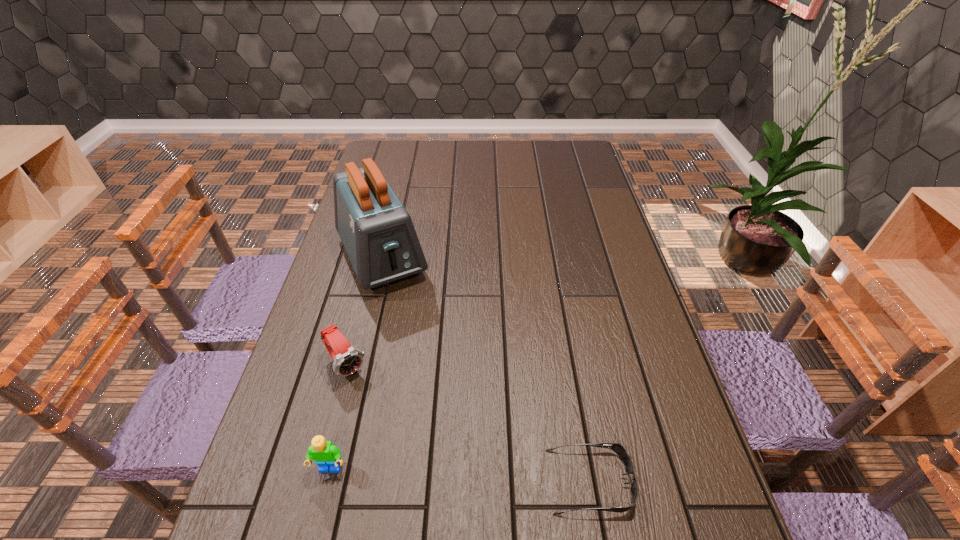
Where is `vacant space that satisfies the following two spatial constraints: 1. on the front side of the rightmost object; 2. on the front-facing side of the toaster`? The width and height of the screenshot is (960, 540). vacant space that satisfies the following two spatial constraints: 1. on the front side of the rightmost object; 2. on the front-facing side of the toaster is located at coordinates (328, 481).

You are a GUI agent. You are given a task and a screenshot of the screen. Output one action in this format:
    pyautogui.click(x=<x>, y=<y>)
    Task: Click on the free space that satisfies the following two spatial constraints: 1. on the back side of the tallest object; 2. on the right side of the watch
    The width and height of the screenshot is (960, 540).
    Given the screenshot: What is the action you would take?
    (374, 258)

You are a GUI agent. You are given a task and a screenshot of the screen. Output one action in this format:
    pyautogui.click(x=<x>, y=<y>)
    Task: Click on the free space in the image that satisfies the following two spatial constraints: 1. on the face of the Lego; 2. on the front-facing side of the rightmost object
    This screenshot has height=540, width=960.
    Given the screenshot: What is the action you would take?
    pyautogui.click(x=327, y=481)

Find the location of `vacant space that satisfies the following two spatial constraints: 1. on the face of the Lego; 2. on the front-facing side of the sunglasses`. vacant space that satisfies the following two spatial constraints: 1. on the face of the Lego; 2. on the front-facing side of the sunglasses is located at coordinates (327, 481).